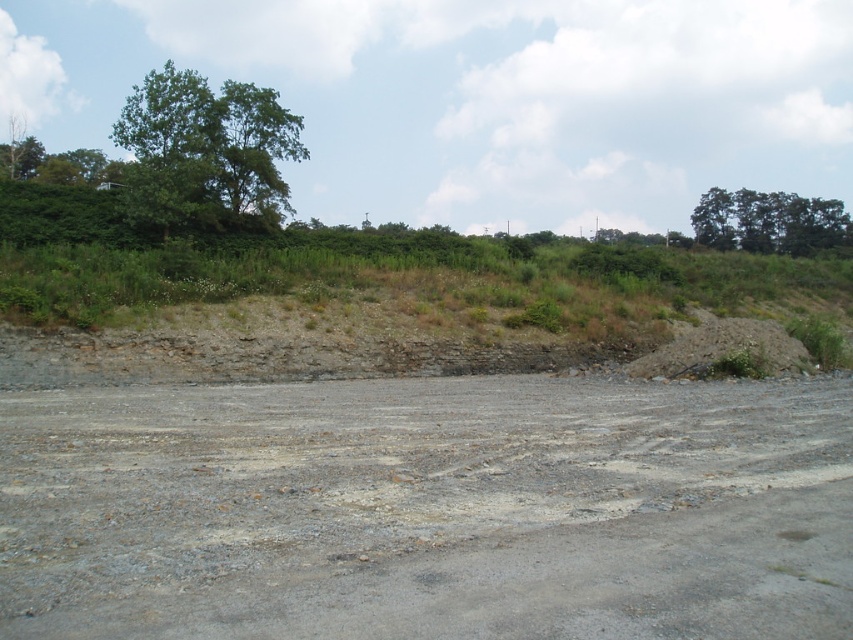
You are navigating a construction site and need to reach the green leafy trees at upper right. There is a gray gravel dirt track at center. Which direction should you head to reach the trees?

The gray gravel dirt track at center is positioned under green leafy trees at upper right, so you should head towards the gray gravel dirt track at center to reach the green leafy trees at upper right.

You are standing at the point marked by the coordinate point at point (x=374, y=316). What is the terrain like around you?

You are standing on the brown dirt hillside at upper center located at point (x=374, y=316). The terrain around you is part of an open, uneven construction site with gravelly and muddy patches in the foreground and a sloping embankment covered in mixed vegetation in the middle ground.

You are a delivery person needing to reach a destination located behind the green leafy trees at upper right. You have a heavy cart that can only move on solid ground. Can you use the gray gravel dirt track at center to reach the destination?

The gray gravel dirt track at center is in front of the green leafy trees at upper right, meaning the track is between you and the trees. Since the track is solid ground, you can use it to reach the destination behind the trees.